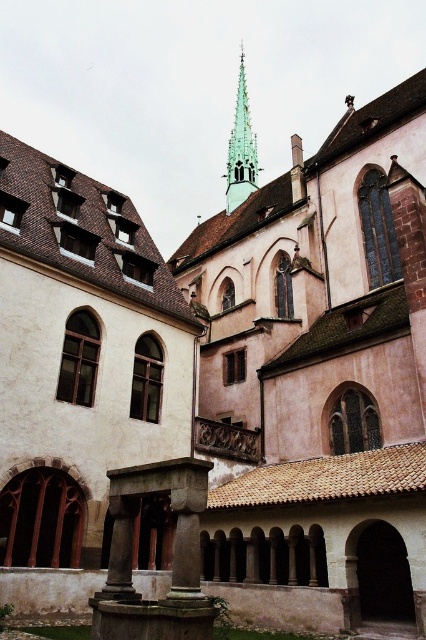
Which is below, green stone fountain at lower center or green glass spire at upper center?

green stone fountain at lower center is lower down.

In the scene shown: Who is shorter, green stone fountain at lower center or green glass spire at upper center?

green stone fountain at lower center

Between point (183, 604) and point (233, 164), which one is positioned behind?

Point (233, 164)

Locate an element on the screen. The height and width of the screenshot is (640, 426). green stone fountain at lower center is located at coordinates (172, 556).